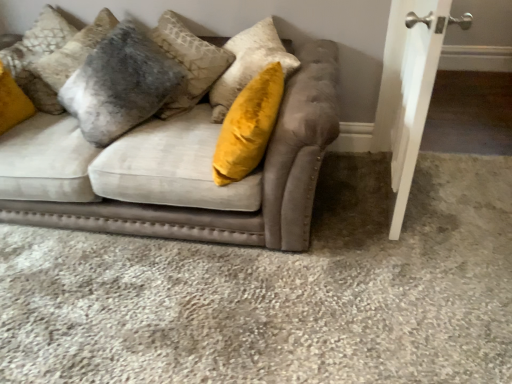
Image resolution: width=512 pixels, height=384 pixels. What do you see at coordinates (414, 102) in the screenshot? I see `white smooth door at right` at bounding box center [414, 102].

Where is `velvet beige couch at center`? This screenshot has height=384, width=512. velvet beige couch at center is located at coordinates (177, 171).

At what (x,y) coordinates should I click in order to perform the action: click on velvet gray pillow at upper left. Please return your answer as a coordinate pair (x, y). Looking at the image, I should click on (64, 63).

From the image's perspective, which object appears higher, white smooth door at right or velvet gray pillow at upper left?

velvet gray pillow at upper left is shown above in the image.

Considering the relative positions of white smooth door at right and velvet gray pillow at upper left in the image provided, is white smooth door at right behind velvet gray pillow at upper left?

No, it is not.

Consider the image. Is white smooth door at right not near velvet gray pillow at upper left?

Yes, white smooth door at right and velvet gray pillow at upper left are quite far apart.

Which is farther, (284, 205) or (77, 50)?

Point (77, 50)

Considering the sizes of objects velvet beige couch at center and velvet gray pillow at upper left in the image provided, who is thinner, velvet beige couch at center or velvet gray pillow at upper left?

With smaller width is velvet gray pillow at upper left.

Is velvet gray pillow at upper left at the back of velvet beige couch at center?

Yes, velvet gray pillow at upper left is at the back of velvet beige couch at center.

Which of these two, velvet beige couch at center or velvet gray pillow at upper left, is bigger?

With larger size is velvet beige couch at center.

Is the position of velvet beige couch at center more distant than that of white smooth door at right?

Yes, the depth of velvet beige couch at center is greater than that of white smooth door at right.

From a real-world perspective, which object rests below the other?

velvet beige couch at center.

Is white smooth door at right at the back of velvet beige couch at center?

No.

Considering the relative positions of velvet gray pillow at upper left and velvet beige couch at center in the image provided, is velvet gray pillow at upper left to the left of velvet beige couch at center from the viewer's perspective?

Yes, velvet gray pillow at upper left is to the left of velvet beige couch at center.

In terms of width, does velvet gray pillow at upper left look wider or thinner when compared to velvet beige couch at center?

Considering their sizes, velvet gray pillow at upper left looks slimmer than velvet beige couch at center.

From the image's perspective, would you say velvet gray pillow at upper left is positioned over velvet beige couch at center?

Yes, from the image's perspective, velvet gray pillow at upper left is above velvet beige couch at center.

From a real-world perspective, is velvet gray pillow at upper left physically located above or below velvet beige couch at center?

velvet gray pillow at upper left is situated higher than velvet beige couch at center in the real world.

From a real-world perspective, is velvet gray pillow at upper left located beneath white smooth door at right?

No, from a real-world perspective, velvet gray pillow at upper left is not below white smooth door at right.

From the picture: Does velvet gray pillow at upper left touch white smooth door at right?

velvet gray pillow at upper left and white smooth door at right are clearly separated.

Is velvet gray pillow at upper left situated inside white smooth door at right or outside?

velvet gray pillow at upper left is not inside white smooth door at right, it's outside.

Which is in front, point (405, 178) or point (251, 188)?

The point (251, 188) is closer to the camera.

Considering the sizes of objects white smooth door at right and velvet beige couch at center in the image provided, who is taller, white smooth door at right or velvet beige couch at center?

Standing taller between the two is white smooth door at right.

Considering the relative sizes of white smooth door at right and velvet beige couch at center in the image provided, is white smooth door at right bigger than velvet beige couch at center?

Incorrect, white smooth door at right is not larger than velvet beige couch at center.

Would you say white smooth door at right is inside or outside velvet beige couch at center?

white smooth door at right cannot be found inside velvet beige couch at center.

This screenshot has height=384, width=512. What are the coordinates of `door on the right of velvet gray pillow at upper left` in the screenshot? It's located at (414, 102).

Find the location of `pillow behind the velvet beige couch at center`. pillow behind the velvet beige couch at center is located at coordinates [64, 63].

Which object lies further to the anchor point white smooth door at right, velvet gray pillow at upper left or velvet beige couch at center?

velvet gray pillow at upper left.

Based on their spatial positions, is white smooth door at right or velvet beige couch at center further from velvet gray pillow at upper left?

white smooth door at right is positioned further to the anchor velvet gray pillow at upper left.

Looking at this image, from the image, which object appears to be farther from white smooth door at right, velvet beige couch at center or velvet gray pillow at upper left?

The object further to white smooth door at right is velvet gray pillow at upper left.

Which object lies further to the anchor point velvet gray pillow at upper left, velvet beige couch at center or white smooth door at right?

white smooth door at right.

Estimate the real-world distances between objects in this image. Which object is further from velvet beige couch at center, white smooth door at right or velvet gray pillow at upper left?

The object further to velvet beige couch at center is white smooth door at right.

Looking at the image, which one is located further to velvet beige couch at center, velvet gray pillow at upper left or white smooth door at right?

Among the two, white smooth door at right is located further to velvet beige couch at center.

Identify the location of studio couch between velvet gray pillow at upper left and white smooth door at right from left to right. Image resolution: width=512 pixels, height=384 pixels. (177, 171).